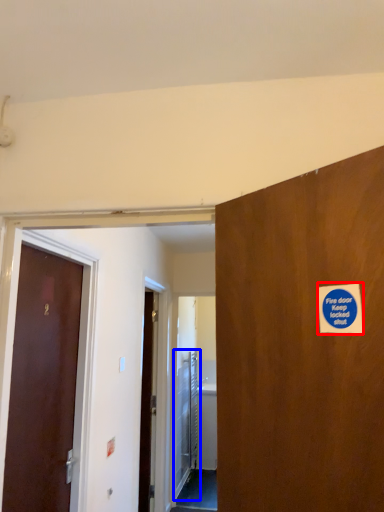
Question: Which object appears farthest to the camera in this image, sticker (highlighted by a red box) or elevator door (highlighted by a blue box)?

Choices:
 (A) sticker
 (B) elevator door

Answer: (B)